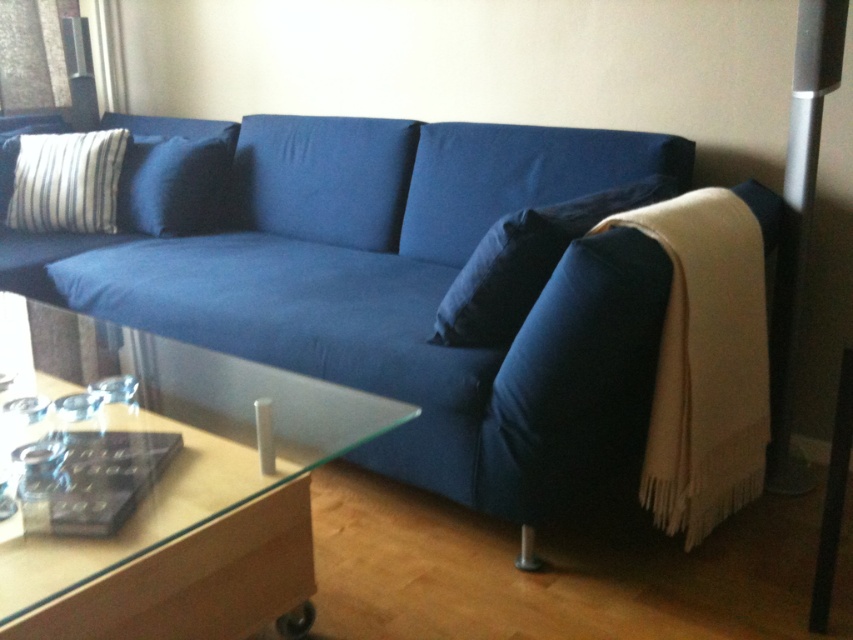
Question: Does dark blue fabric pillow at center have a lesser width compared to blue fabric pillow at upper left?

Choices:
 (A) yes
 (B) no

Answer: (A)

Question: Estimate the real-world distances between objects in this image. Which object is farther from the matte blue couch at center?

Choices:
 (A) blue fabric pillow at upper left
 (B) transparent glass side table at lower left
 (C) dark blue fabric pillow at center
 (D) striped fabric pillow at upper left

Answer: (B)

Question: Which object is farther from the camera taking this photo?

Choices:
 (A) matte blue couch at center
 (B) transparent glass side table at lower left
 (C) beige woolen blanket at lower right
 (D) dark blue fabric pillow at center

Answer: (D)

Question: Can you confirm if transparent glass side table at lower left is smaller than beige woolen blanket at lower right?

Choices:
 (A) no
 (B) yes

Answer: (A)

Question: Is beige woolen blanket at lower right below blue fabric pillow at upper left?

Choices:
 (A) yes
 (B) no

Answer: (A)

Question: Estimate the real-world distances between objects in this image. Which object is closer to the beige woolen blanket at lower right?

Choices:
 (A) blue fabric pillow at upper left
 (B) matte blue couch at center
 (C) dark blue fabric pillow at center

Answer: (C)